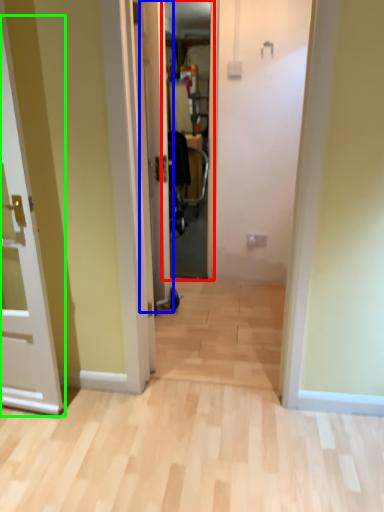
Question: Which object is the closest to the screen door (highlighted by a red box)? Choose among these: door (highlighted by a blue box) or door (highlighted by a green box).

Choices:
 (A) door
 (B) door

Answer: (A)